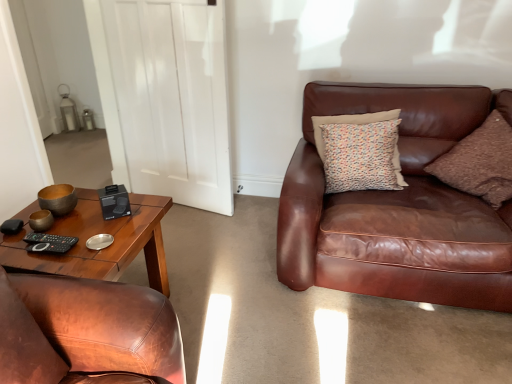
The image size is (512, 384). What are the coordinates of `vacant space to the right of black matte remote at lower left` in the screenshot? It's located at click(x=99, y=246).